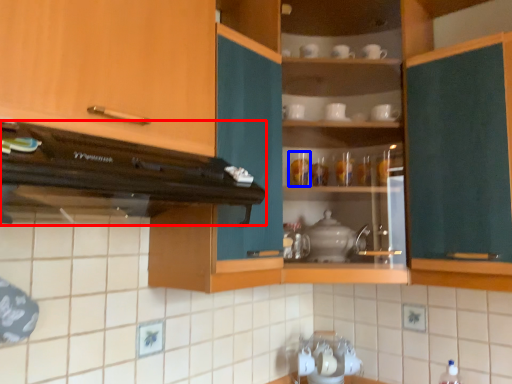
Question: Which of the following is the farthest to the observer, home appliance (highlighted by a red box) or tableware (highlighted by a blue box)?

Choices:
 (A) home appliance
 (B) tableware

Answer: (B)